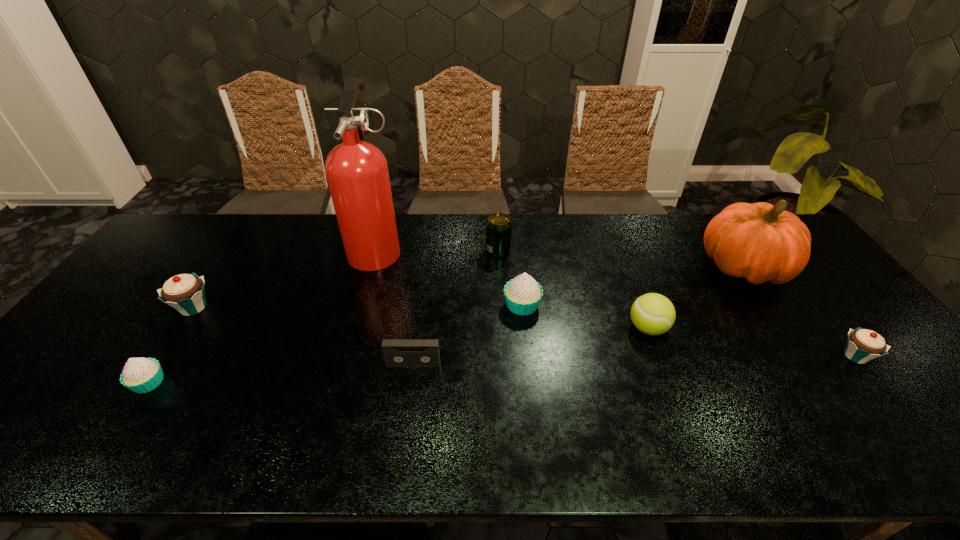
Identify the location of free space located 0.160m on the front of the left teal cupcake. (151, 372).

Where is `free space located on the right of the third object from right to left`? The image size is (960, 540). free space located on the right of the third object from right to left is located at coordinates (690, 328).

This screenshot has height=540, width=960. Identify the location of vacant space located on the back of the rightmost cupcake. (823, 315).

I want to click on free space located 0.070m on the left of the left white cupcake, so click(x=103, y=382).

At what (x,y) coordinates should I click in order to perform the action: click on vacant area located 0.190m on the front-facing side of the sixth object from right to left. Please return your answer as a coordinate pair (x, y). This screenshot has height=540, width=960. Looking at the image, I should click on (403, 439).

Where is `fire extinguisher that is at the far edge`? This screenshot has height=540, width=960. fire extinguisher that is at the far edge is located at coordinates (357, 173).

The width and height of the screenshot is (960, 540). Find the location of `pumpkin that is positioned at the far edge`. pumpkin that is positioned at the far edge is located at coordinates [760, 242].

In order to click on beer can that is at the far edge in this screenshot , I will do `click(498, 225)`.

Locate an element on the screen. This screenshot has width=960, height=540. pumpkin that is positioned at the right edge is located at coordinates pyautogui.click(x=760, y=242).

You are a GUI agent. You are given a task and a screenshot of the screen. Output one action in this format:
    pyautogui.click(x=<x>, y=<y>)
    Task: Click on the cupcake located at the right edge
    This screenshot has height=540, width=960.
    Given the screenshot: What is the action you would take?
    pyautogui.click(x=863, y=345)